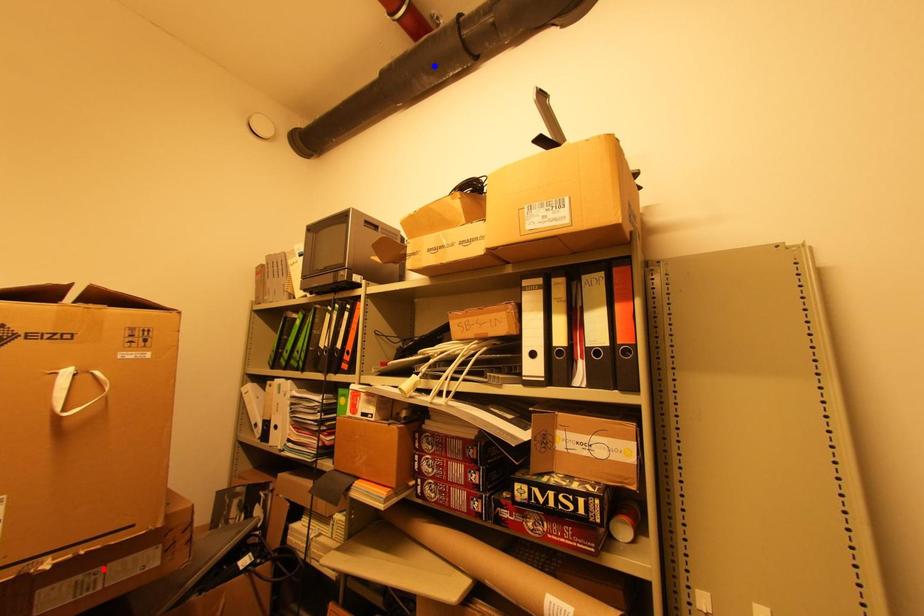
Question: In the image, two points are highlighted. Which point is nearer to the camera? Reply with the corresponding letter.

Choices:
 (A) blue point
 (B) red point

Answer: (B)